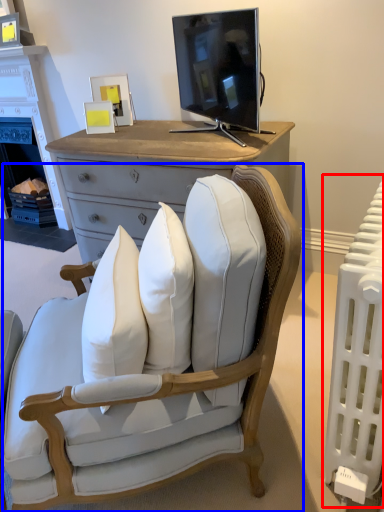
Question: Which point is closer to the camera, radiator (highlighted by a red box) or chair (highlighted by a blue box)?

Choices:
 (A) radiator
 (B) chair

Answer: (B)